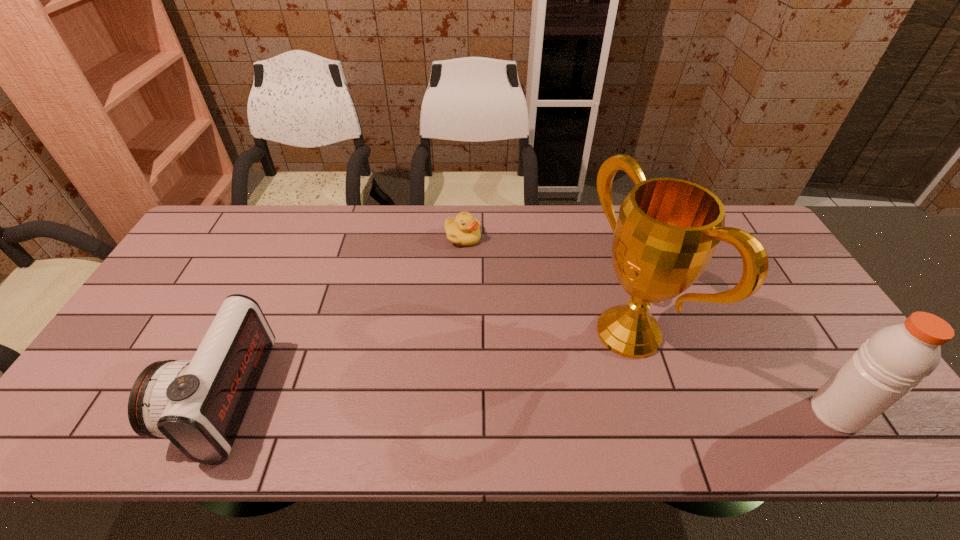
Identify the location of shaker located at the near edge. (897, 358).

In order to click on award that is positioned at the near edge in this screenshot , I will do `click(667, 231)`.

Where is `object that is at the right edge`? This screenshot has width=960, height=540. object that is at the right edge is located at coordinates (897, 358).

This screenshot has height=540, width=960. I want to click on object that is positioned at the near right corner, so click(x=897, y=358).

I want to click on free space at the far edge of the desktop, so click(x=270, y=246).

In the image, there is a desktop. Find the location of `vacant space at the near edge`. vacant space at the near edge is located at coordinates (520, 381).

The image size is (960, 540). What are the coordinates of `vacant space at the left edge` in the screenshot? It's located at (220, 266).

In the image, there is a desktop. At what (x,y) coordinates should I click in order to perform the action: click on free space at the far left corner. Please return your answer as a coordinate pair (x, y). The width and height of the screenshot is (960, 540). Looking at the image, I should click on (234, 223).

Image resolution: width=960 pixels, height=540 pixels. I want to click on vacant point located between the award and the farthest object, so click(x=545, y=285).

At what (x,y) coordinates should I click in order to perform the action: click on blank region between the tallest object and the shortest object. Please return your answer as a coordinate pair (x, y). The width and height of the screenshot is (960, 540). Looking at the image, I should click on (545, 285).